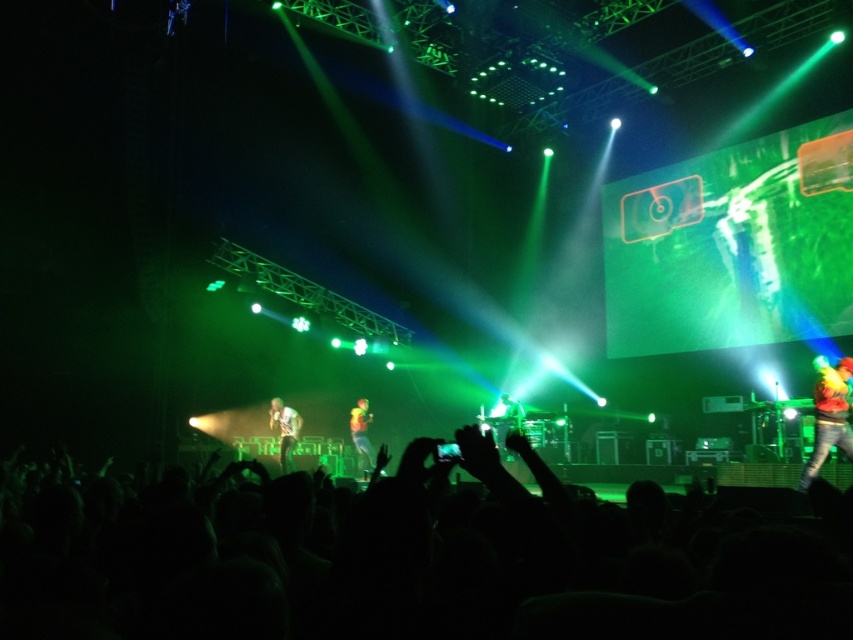
Question: Is white textured shirt at center to the left of shiny silver microphone at center from the viewer's perspective?

Choices:
 (A) yes
 (B) no

Answer: (A)

Question: Which of the following is the closest to the observer?

Choices:
 (A) white textured shirt at center
 (B) shiny silver microphone at center

Answer: (A)

Question: Which of the following is the closest to the observer?

Choices:
 (A) (497, 401)
 (B) (366, 403)

Answer: (B)

Question: Which object is farther from the camera taking this photo?

Choices:
 (A) shiny yellow jacket at center
 (B) silhouette crowd at lower center
 (C) white textured shirt at center

Answer: (A)

Question: From the image, what is the correct spatial relationship of silhouette crowd at lower center in relation to shiny yellow jacket at center?

Choices:
 (A) above
 (B) below

Answer: (A)

Question: Considering the relative positions of silhouette crowd at lower center and shiny metallic jacket at right in the image provided, where is silhouette crowd at lower center located with respect to shiny metallic jacket at right?

Choices:
 (A) right
 (B) left

Answer: (B)